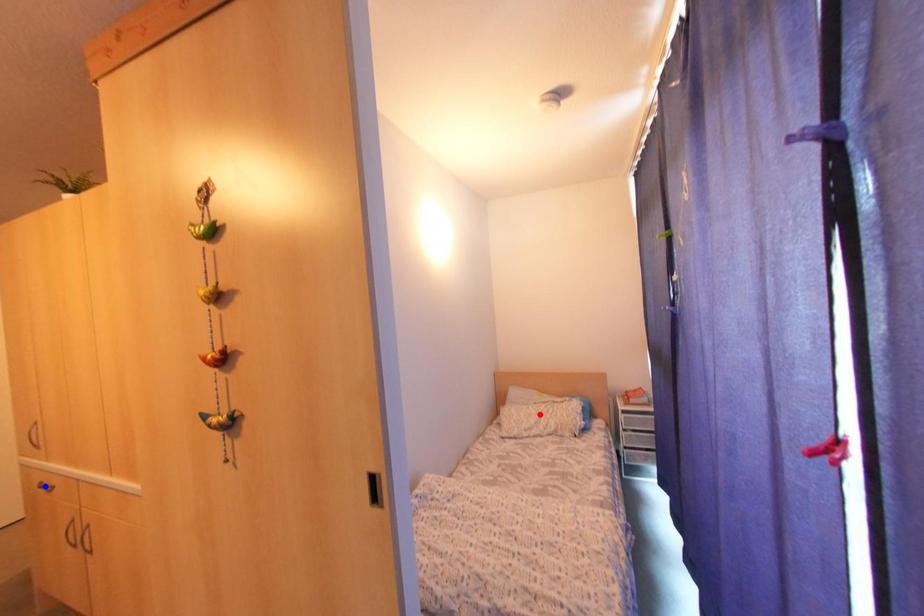
Question: Two points are marked on the image. Which point is closer to the camera?

Choices:
 (A) Blue point is closer.
 (B) Red point is closer.

Answer: (A)